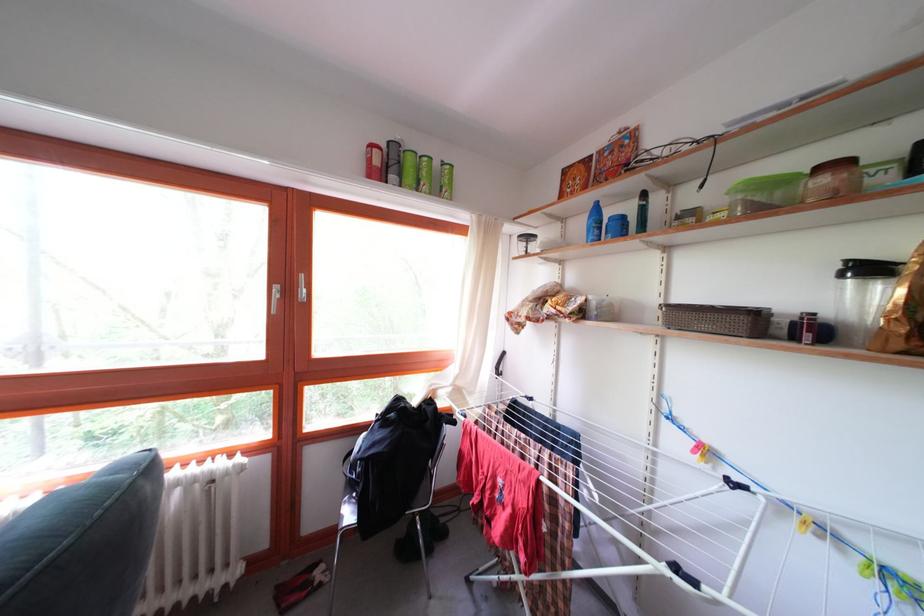
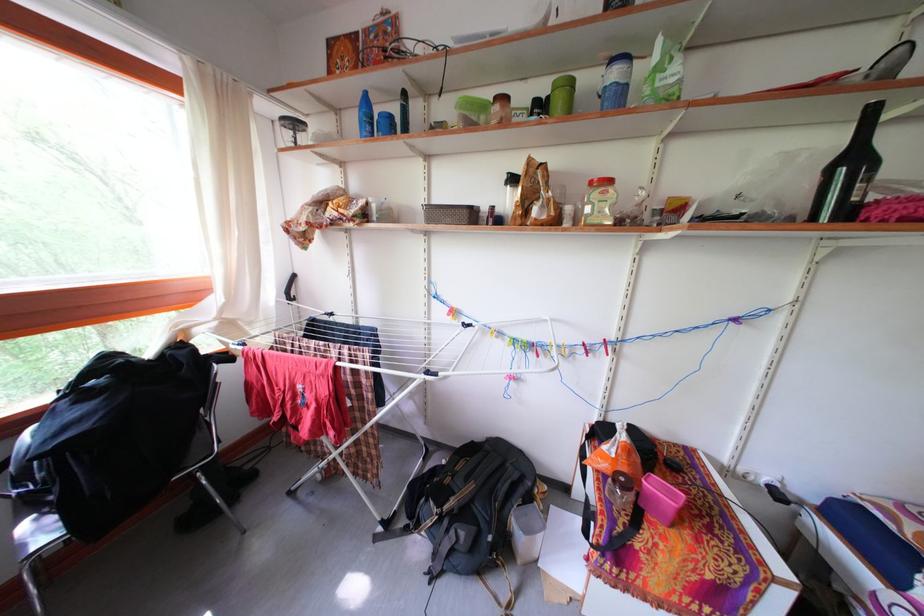
How did the camera likely rotate?

The camera's rotation is toward right-down.